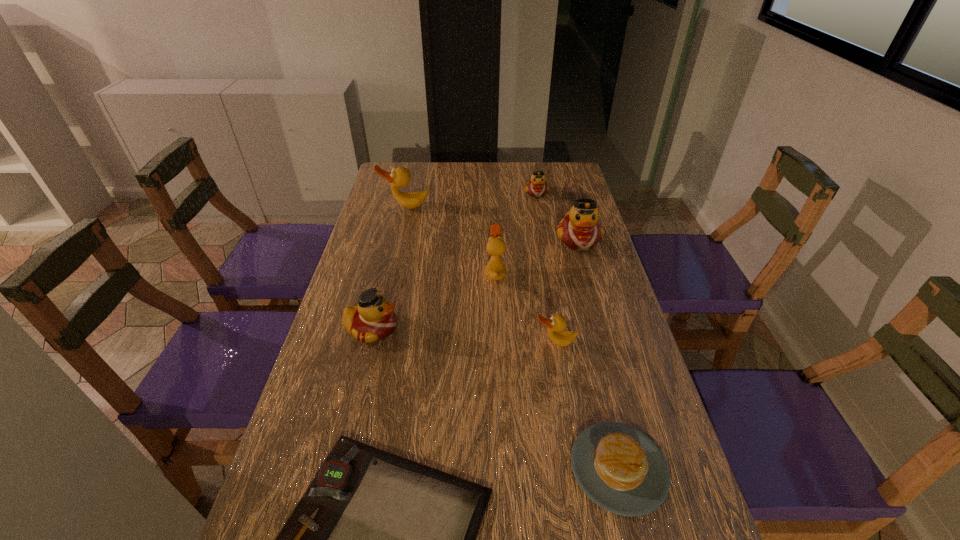
Where is `empty location between the leftmost red duck and the biggest tan duck`? The height and width of the screenshot is (540, 960). empty location between the leftmost red duck and the biggest tan duck is located at coordinates (389, 268).

In order to click on vacant area that lies between the smallest red duck and the nearest red duck in this screenshot , I will do `click(454, 261)`.

Find the location of a particular element. Image resolution: width=960 pixels, height=540 pixels. free space that is in between the second farthest tan duck and the nearest tan duck is located at coordinates (525, 308).

Locate an element on the screen. The image size is (960, 540). empty space that is in between the farthest object and the second shortest object is located at coordinates (578, 330).

The image size is (960, 540). Find the location of `vacant area that lies between the nearest tan duck and the biggest tan duck`. vacant area that lies between the nearest tan duck and the biggest tan duck is located at coordinates click(x=480, y=274).

Locate an element on the screen. This screenshot has height=540, width=960. free space that is in between the smallest red duck and the farthest tan duck is located at coordinates (471, 200).

Where is `vacant region between the nearest red duck and the second shortest object`? Image resolution: width=960 pixels, height=540 pixels. vacant region between the nearest red duck and the second shortest object is located at coordinates (495, 399).

In order to click on the third closest object to the smallest red duck in this screenshot , I will do `click(495, 269)`.

Point out which object is positioned as the nearest to the pancake. Please provide its 2D coordinates. Your answer should be formatted as a tuple, i.e. [(x, y)], where the tuple contains the x and y coordinates of a point satisfying the conditions above.

[(377, 539)]

Find the location of `duck that is the closest to the second farthest tan duck`. duck that is the closest to the second farthest tan duck is located at coordinates (580, 230).